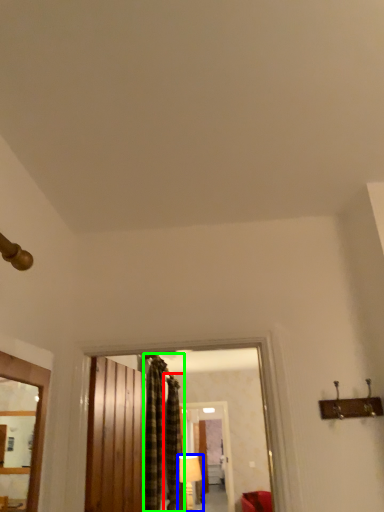
Question: Which object is positioned closest to curtain (highlighted by a red box)? Select from lamp (highlighted by a blue box) and curtain (highlighted by a green box).

Choices:
 (A) lamp
 (B) curtain

Answer: (B)